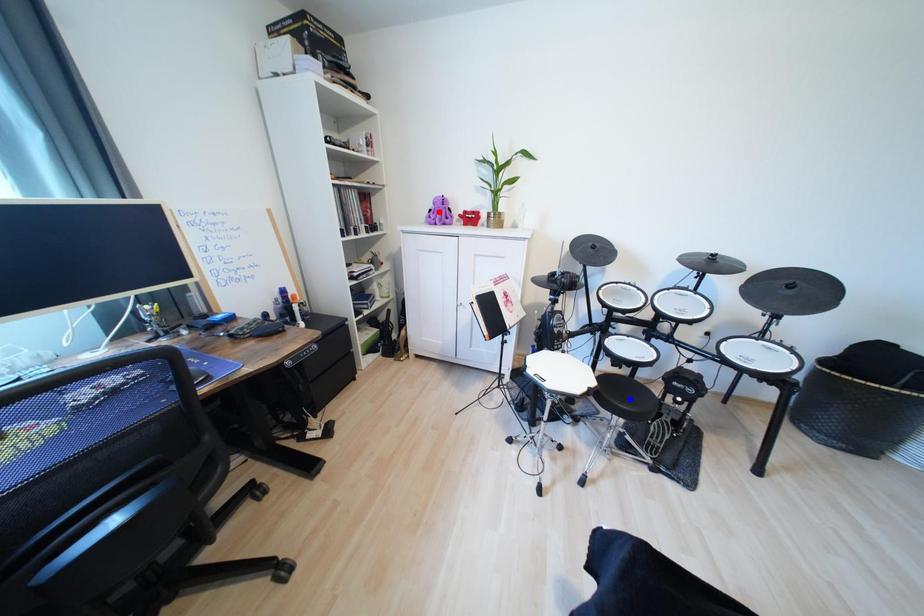
Question: Which of the two points in the image is closer to the camera?

Choices:
 (A) Blue point is closer.
 (B) Red point is closer.

Answer: (A)